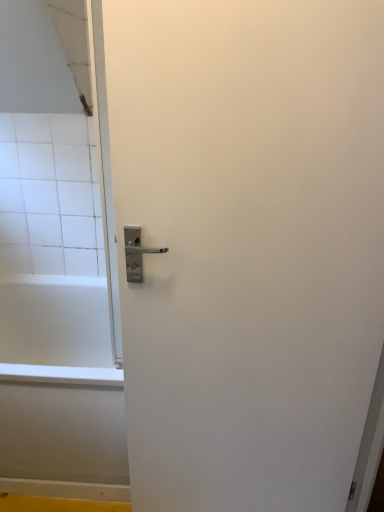
Question: Do you think white matte door handle at center is within white glossy bathtub at lower left, or outside of it?

Choices:
 (A) outside
 (B) inside

Answer: (A)

Question: In terms of height, does white matte door handle at center look taller or shorter compared to white glossy bathtub at lower left?

Choices:
 (A) tall
 (B) short

Answer: (A)

Question: From a real-world perspective, relative to white glossy bathtub at lower left, is white matte door handle at center vertically above or below?

Choices:
 (A) below
 (B) above

Answer: (B)

Question: From a real-world perspective, relative to white matte door handle at center, is white glossy bathtub at lower left vertically above or below?

Choices:
 (A) above
 (B) below

Answer: (B)

Question: Considering the positions of point (48, 330) and point (311, 189), is point (48, 330) closer or farther from the camera than point (311, 189)?

Choices:
 (A) closer
 (B) farther

Answer: (B)

Question: Is white glossy bathtub at lower left wider or thinner than white matte door handle at center?

Choices:
 (A) thin
 (B) wide

Answer: (B)

Question: Would you say white glossy bathtub at lower left is inside or outside white matte door handle at center?

Choices:
 (A) outside
 (B) inside

Answer: (A)